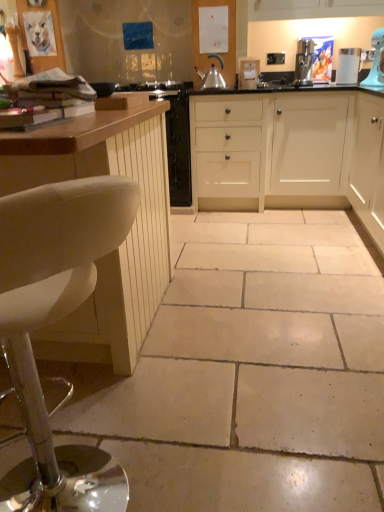
This screenshot has height=512, width=384. Find the location of `empty space that is ontop of beige tile floor at center (from a real-world perspective)`. empty space that is ontop of beige tile floor at center (from a real-world perspective) is located at coordinates (234, 303).